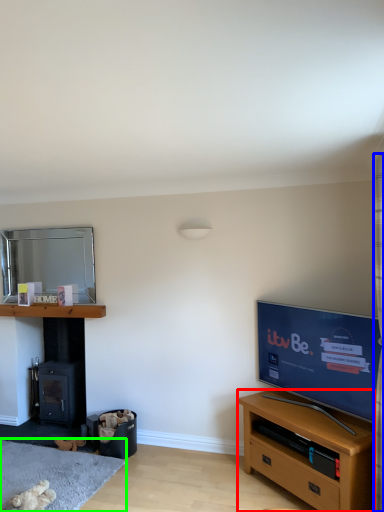
Question: Estimate the real-world distances between objects in this image. Which object is closer to cabinetry (highlighted by a red box), curtain (highlighted by a blue box) or plain (highlighted by a green box)?

Choices:
 (A) curtain
 (B) plain

Answer: (A)